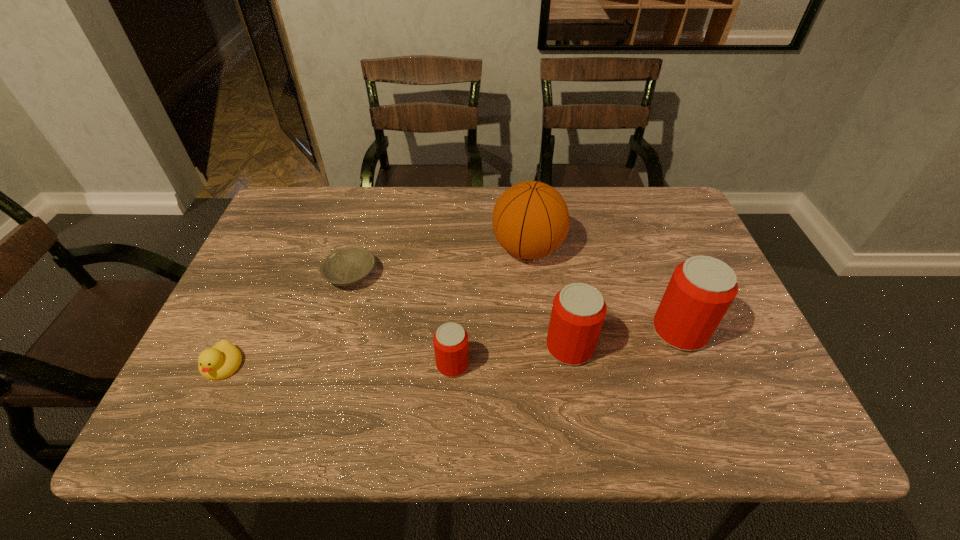
At what (x,y) coordinates should I click in order to perform the action: click on vacant space at the far edge. Please return your answer as a coordinate pair (x, y). The width and height of the screenshot is (960, 540). Looking at the image, I should click on (429, 211).

Where is `free space at the near edge of the desktop`? Image resolution: width=960 pixels, height=540 pixels. free space at the near edge of the desktop is located at coordinates (588, 382).

Locate an element on the screen. free space at the right edge of the desktop is located at coordinates (719, 332).

At what (x,y) coordinates should I click in order to perform the action: click on vacant region at the far left corner. Please return your answer as a coordinate pair (x, y). The height and width of the screenshot is (540, 960). Looking at the image, I should click on (274, 226).

The height and width of the screenshot is (540, 960). In the image, there is a desktop. In order to click on vacant region at the far right corner in this screenshot , I will do `click(664, 188)`.

The width and height of the screenshot is (960, 540). Identify the location of vacant point located between the second tallest beer can and the basketball. (549, 298).

Where is `vacant area that lies between the second tallest beer can and the shortest beer can`? The width and height of the screenshot is (960, 540). vacant area that lies between the second tallest beer can and the shortest beer can is located at coordinates (512, 356).

Locate an element on the screen. This screenshot has width=960, height=540. blank region between the second object from left to right and the rightmost beer can is located at coordinates (516, 303).

This screenshot has width=960, height=540. In order to click on vacant region between the shortest beer can and the second object from left to right in this screenshot , I will do `click(402, 320)`.

This screenshot has height=540, width=960. I want to click on vacant area that lies between the second shortest object and the fourth object from right to left, so click(338, 365).